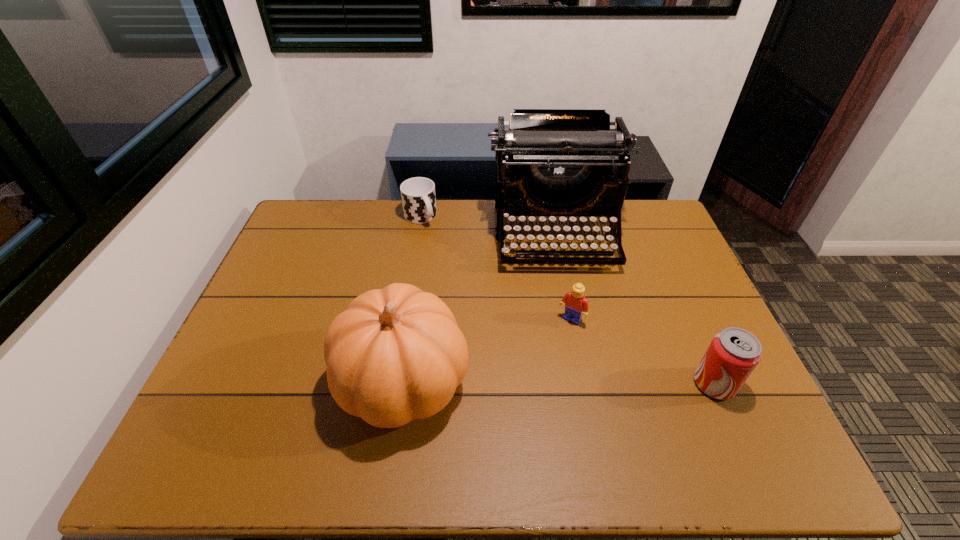
Image resolution: width=960 pixels, height=540 pixels. What are the coordinates of `the closest object to the Lego` in the screenshot? It's located at (551, 162).

Image resolution: width=960 pixels, height=540 pixels. I want to click on vacant position in the image that satisfies the following two spatial constraints: 1. on the back side of the pumpkin; 2. on the left side of the typewriter, so click(x=424, y=234).

Image resolution: width=960 pixels, height=540 pixels. Identify the location of blank space that satisfies the following two spatial constraints: 1. on the front side of the tallest object; 2. on the right side of the third shortest object. (585, 383).

Locate an element on the screen. Image resolution: width=960 pixels, height=540 pixels. vacant region that satisfies the following two spatial constraints: 1. on the back side of the pumpkin; 2. on the right side of the tallest object is located at coordinates (424, 234).

Locate an element on the screen. vacant space that satisfies the following two spatial constraints: 1. on the front side of the fourth shortest object; 2. on the right side of the cup is located at coordinates (394, 382).